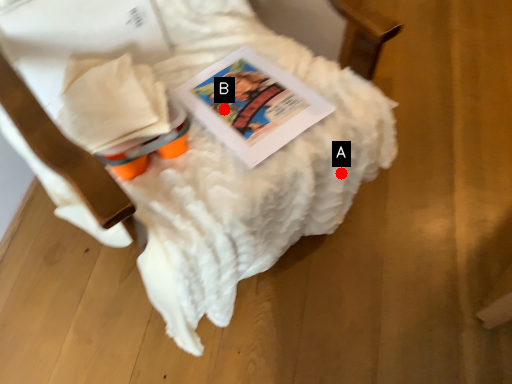
Question: Two points are circled on the image, labeled by A and B beside each circle. Which point is closer to the camera?

Choices:
 (A) A is closer
 (B) B is closer

Answer: (B)